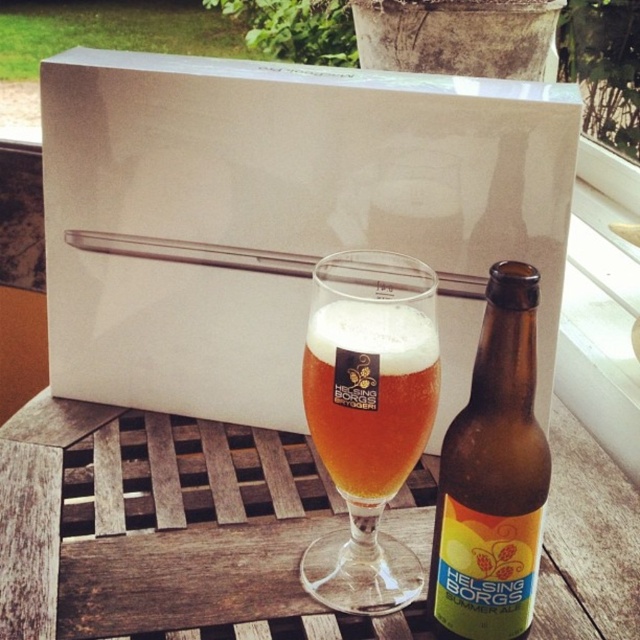
Question: Among these objects, which one is farthest from the camera?

Choices:
 (A) wooden slatted table at center
 (B) brown glass bottle at center

Answer: (A)

Question: Does wooden slatted table at center have a greater width compared to brown glass bottle at center?

Choices:
 (A) yes
 (B) no

Answer: (A)

Question: Is brown glass bottle at center wider than golden amber liquid at center?

Choices:
 (A) no
 (B) yes

Answer: (A)

Question: Which of the following is the farthest from the observer?

Choices:
 (A) (324, 369)
 (B) (161, 476)

Answer: (B)

Question: Can you confirm if wooden slatted table at center is positioned below golden amber liquid at center?

Choices:
 (A) no
 (B) yes

Answer: (B)

Question: Which object is positioned closest to the brown glass bottle at center?

Choices:
 (A) golden amber liquid at center
 (B) wooden slatted table at center

Answer: (A)